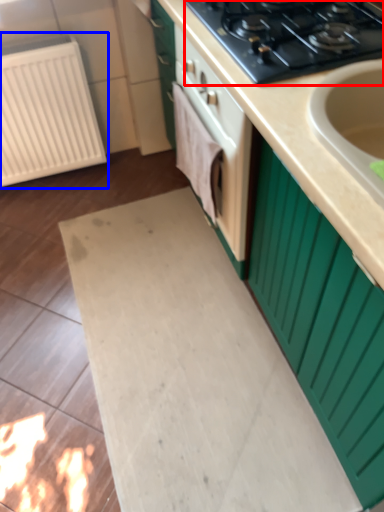
Question: Which of the following is the closest to the observer, gas stove (highlighted by a red box) or radiator (highlighted by a blue box)?

Choices:
 (A) gas stove
 (B) radiator

Answer: (A)